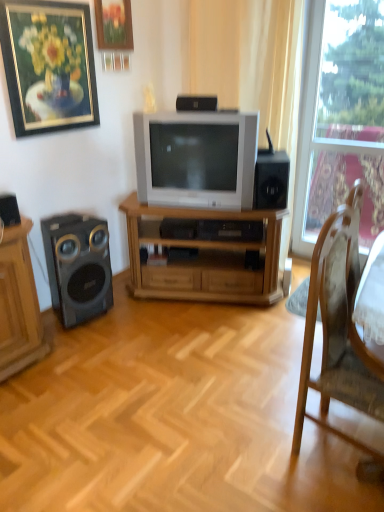
Question: From the image's perspective, is gold-framed painting at upper left, the 1th picture frame from the left, on black matte speaker at right, the 2th speaker in the top-to-bottom sequence?

Choices:
 (A) no
 (B) yes

Answer: (B)

Question: Is gold-framed painting at upper left, marked as the second picture frame in a right-to-left arrangement, surrounding black matte speaker at right, the 3th speaker when ordered from front to back?

Choices:
 (A) no
 (B) yes

Answer: (A)

Question: Is gold-framed painting at upper left, marked as the second picture frame in a right-to-left arrangement, shorter than black matte speaker at right, which is counted as the first speaker, starting from the right?

Choices:
 (A) yes
 (B) no

Answer: (B)

Question: Is gold-framed painting at upper left, marked as the second picture frame in a right-to-left arrangement, thinner than black matte speaker at right, the 3th speaker when ordered from front to back?

Choices:
 (A) yes
 (B) no

Answer: (A)

Question: Is gold-framed painting at upper left, the 1th picture frame from the left, located outside black matte speaker at right, the 3th speaker when ordered from front to back?

Choices:
 (A) yes
 (B) no

Answer: (A)

Question: From a real-world perspective, is wooden tv stand at center above or below black matte speaker at right, the 2th speaker in the top-to-bottom sequence?

Choices:
 (A) above
 (B) below

Answer: (B)

Question: Looking at the image, does wooden tv stand at center seem bigger or smaller compared to black matte speaker at right, the first speaker positioned from the back?

Choices:
 (A) small
 (B) big

Answer: (B)

Question: Is wooden tv stand at center in front of or behind black matte speaker at right, which is counted as the first speaker, starting from the right, in the image?

Choices:
 (A) front
 (B) behind

Answer: (B)

Question: Considering the relative positions of wooden tv stand at center and black matte speaker at right, the 3th speaker when ordered from front to back, in the image provided, is wooden tv stand at center to the left or to the right of black matte speaker at right, the 3th speaker when ordered from front to back,?

Choices:
 (A) left
 (B) right

Answer: (A)

Question: Is matte black speaker at left in front of or behind black matte speaker at right, which is counted as the first speaker, starting from the right, in the image?

Choices:
 (A) front
 (B) behind

Answer: (A)

Question: Considering the relative positions of matte black speaker at left and black matte speaker at right, the first speaker positioned from the back, in the image provided, is matte black speaker at left to the left or to the right of black matte speaker at right, the first speaker positioned from the back,?

Choices:
 (A) right
 (B) left

Answer: (B)

Question: Based on their sizes in the image, would you say matte black speaker at left is bigger or smaller than black matte speaker at right, marked as the second speaker in a bottom-to-top arrangement?

Choices:
 (A) small
 (B) big

Answer: (B)

Question: Does point (51, 264) appear closer or farther from the camera than point (263, 184)?

Choices:
 (A) closer
 (B) farther

Answer: (B)

Question: In terms of height, does matte silver television at center look taller or shorter compared to gold-framed painting at upper left, the 1th picture frame from the left?

Choices:
 (A) tall
 (B) short

Answer: (B)

Question: In terms of width, does matte silver television at center look wider or thinner when compared to gold-framed painting at upper left, marked as the second picture frame in a right-to-left arrangement?

Choices:
 (A) wide
 (B) thin

Answer: (A)